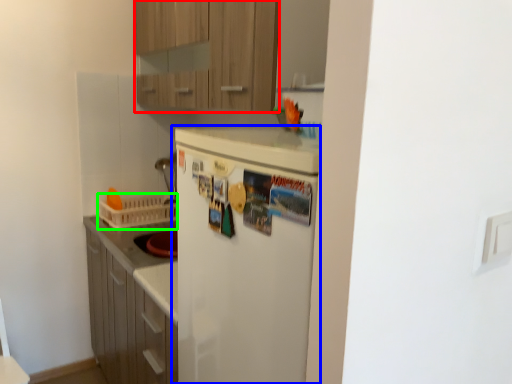
Question: Estimate the real-world distances between objects in this image. Which object is farther from cabinetry (highlighted by a red box), refrigerator (highlighted by a blue box) or basket (highlighted by a green box)?

Choices:
 (A) refrigerator
 (B) basket

Answer: (B)